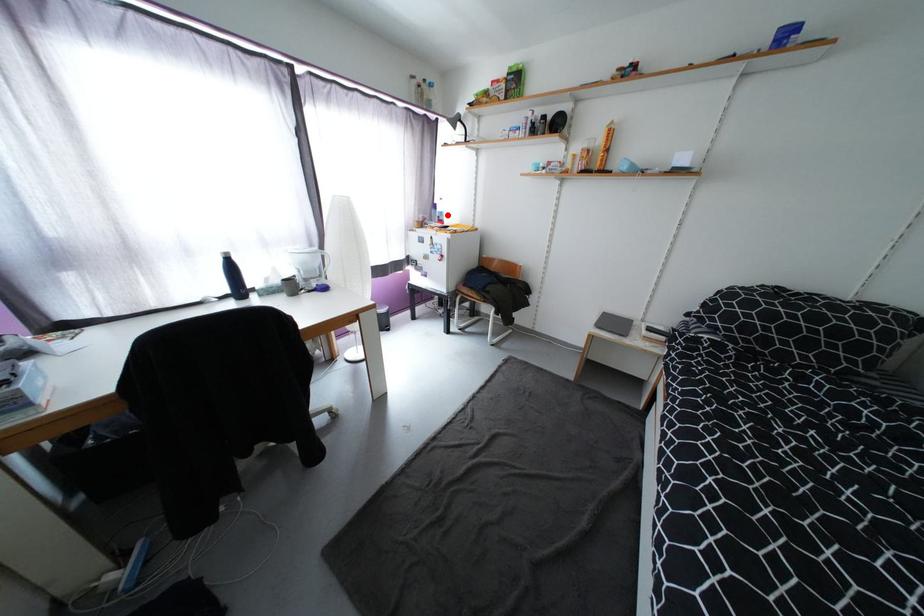
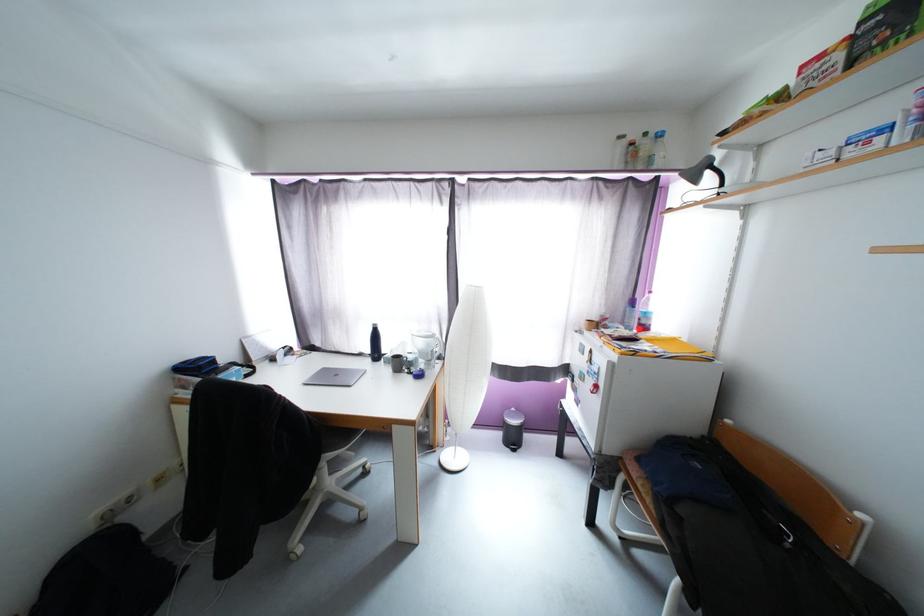
In the second image, find the point that corresponds to the highlighted location in the first image.

(651, 315)